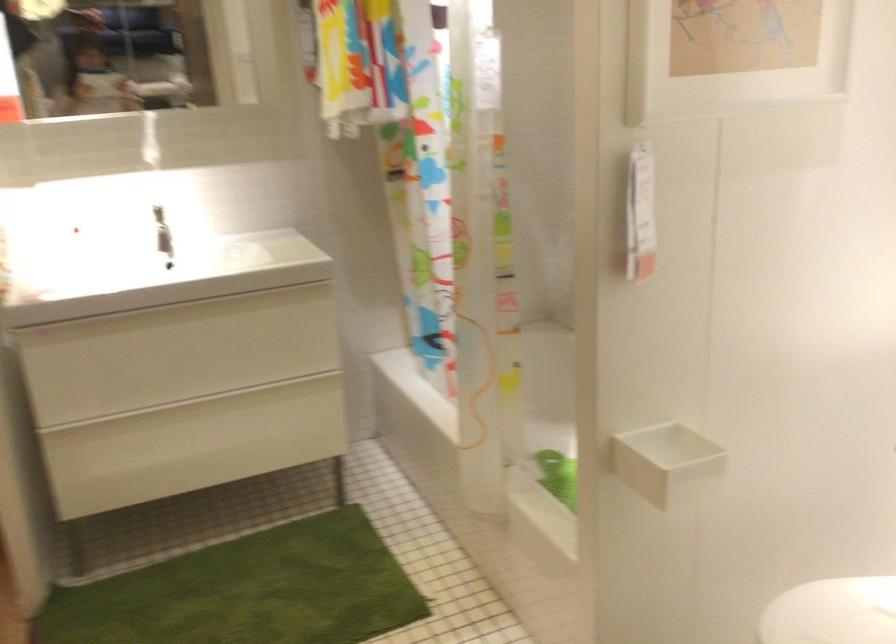
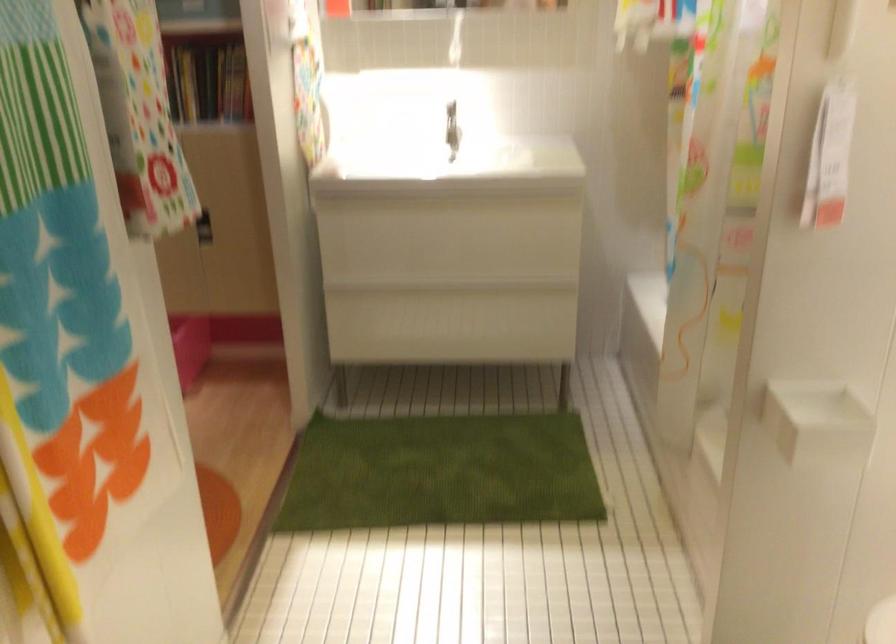
In the second image, find the point that corresponds to (x=183, y=310) in the first image.

(440, 201)